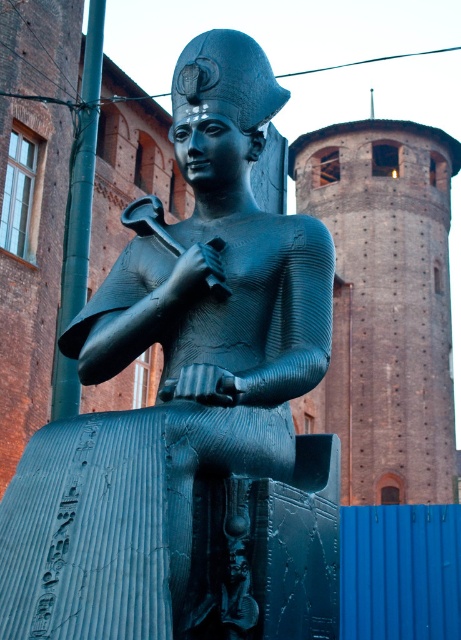
You are an architect planning to install a new lighting system in the area. The lighting system requires that the light source must be placed higher than both the bronze statue at center and the brick tower at upper center. Is this possible given their sizes?

The bronze statue at center has a smaller size compared to brick tower at upper center. Since the brick tower at upper center is taller, the light source must be placed higher than the brick tower at upper center to satisfy both requirements. Therefore, it is possible to place the light source higher than both.

You are an architect designing a new museum exhibit. You need to place the bronze statue at center and the brick tower at upper center in a way that maintains their proportional relationship. Which object should you make wider to ensure they look balanced?

A: To maintain their proportional relationship, the bronze statue at center should be made wider since it is thinner than the brick tower at upper center according to the description.

You are standing in front of the bronze statue at center and want to take a photo of the brick tower at upper center. Since the statue is in the way, where should you move to get an unobstructed view?

The bronze statue at center is located below the brick tower at upper center, so you should move to a position where you can look upward to see the brick tower at upper center above the bronze statue at center.